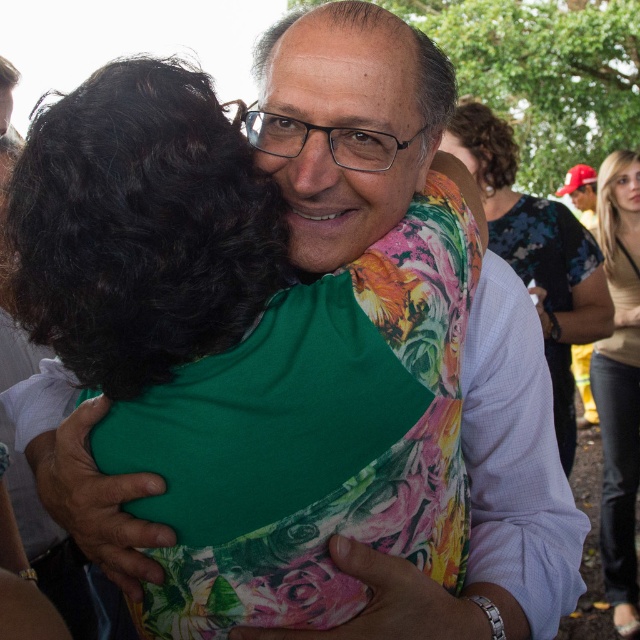
Who is lower down, floral fabric dress at center or light brown leather jacket at right?

light brown leather jacket at right is below.

Who is shorter, floral fabric dress at center or light brown leather jacket at right?

floral fabric dress at center

Which is in front, point (570, 308) or point (612, 321)?

Point (612, 321) is in front.

Identify the location of floral fabric dress at center. The width and height of the screenshot is (640, 640). (536, 253).